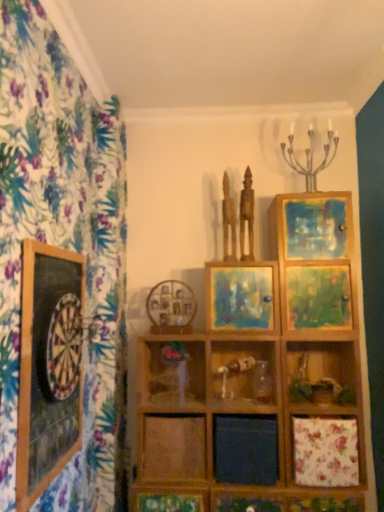
Question: From the image's perspective, is wooden statue at center, marked as the second sculpture in a right-to-left arrangement, above or below matte wooden picture frame at center, the second picture frame in the front-to-back sequence?

Choices:
 (A) above
 (B) below

Answer: (A)

Question: Is point (223, 254) closer or farther from the camera than point (251, 283)?

Choices:
 (A) closer
 (B) farther

Answer: (B)

Question: Which is farther from the wooden shelf at center?

Choices:
 (A) silver metallic candle holder at upper right
 (B) matte brown statue at center, the 2th sculpture when ordered from left to right
 (C) wooden picture frame at center, the third picture frame from the front
 (D) wooden dartboard at left, arranged as the third picture frame when viewed from the back
 (E) matte wooden picture frame at center, the second picture frame in the front-to-back sequence

Answer: (A)

Question: Which object is the closest to the wooden picture frame at center, positioned as the second picture frame in right-to-left order?

Choices:
 (A) matte wooden picture frame at center, the second picture frame in the front-to-back sequence
 (B) wooden statue at center, marked as the second sculpture in a right-to-left arrangement
 (C) wooden shelf at center
 (D) wooden dartboard at left, which appears as the 3th picture frame when viewed from the right
 (E) matte brown statue at center, the first sculpture from the right

Answer: (C)